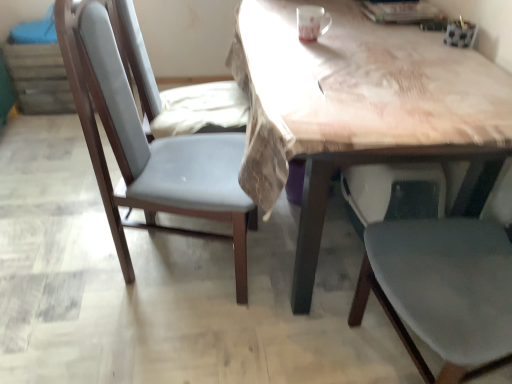
Locate an element on the screen. The height and width of the screenshot is (384, 512). free space to the left of matte gray chair at center is located at coordinates (69, 270).